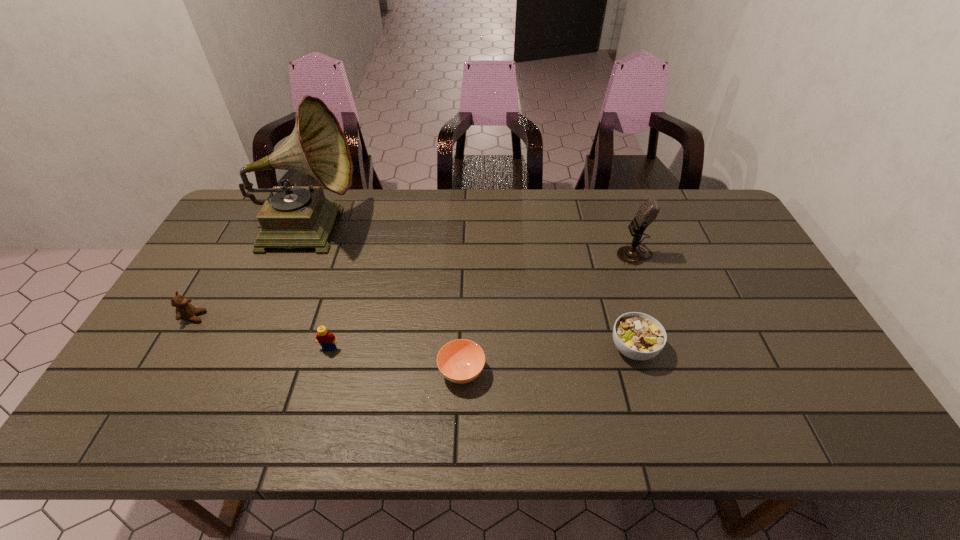
The image size is (960, 540). Identify the location of object that is positioned at the far left corner. (291, 217).

Locate an element on the screen. vacant space at the far edge of the desktop is located at coordinates (488, 222).

Where is `vacant space at the near edge`? This screenshot has width=960, height=540. vacant space at the near edge is located at coordinates (653, 416).

Find the location of `vacant space at the left edge of the desktop`. vacant space at the left edge of the desktop is located at coordinates point(238,276).

What are the coordinates of `blank space at the right edge` in the screenshot? It's located at (789, 331).

Where is `vacant region at the far left corner of the desktop`? vacant region at the far left corner of the desktop is located at coordinates (246, 192).

Find the location of a particular element. The height and width of the screenshot is (540, 960). vacant space at the near left corner of the desktop is located at coordinates (157, 428).

You are a GUI agent. You are given a task and a screenshot of the screen. Output one action in this format:
    pyautogui.click(x=<x>, y=<y>)
    Task: Click on the free space at the far right corner of the desktop
    The height and width of the screenshot is (540, 960).
    Given the screenshot: What is the action you would take?
    pyautogui.click(x=703, y=200)

The height and width of the screenshot is (540, 960). I want to click on vacant region at the near right corner, so click(793, 429).

You are a GUI agent. You are given a task and a screenshot of the screen. Output one action in this format:
    pyautogui.click(x=<x>, y=<y>)
    Task: Click on the free point between the leftmost object and the microphone
    This screenshot has width=960, height=540.
    Given the screenshot: What is the action you would take?
    pyautogui.click(x=415, y=285)